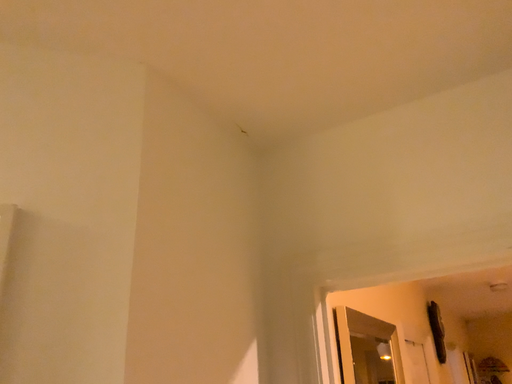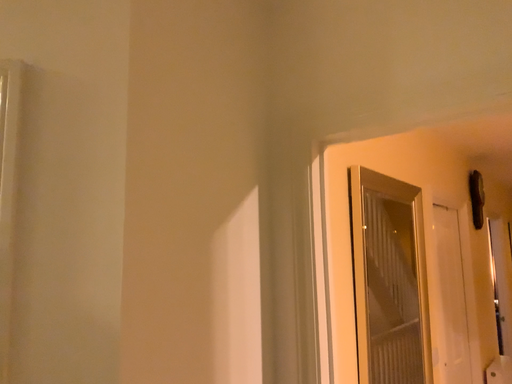
Question: How did the camera likely rotate when shooting the video?

Choices:
 (A) rotated upward
 (B) rotated downward

Answer: (B)